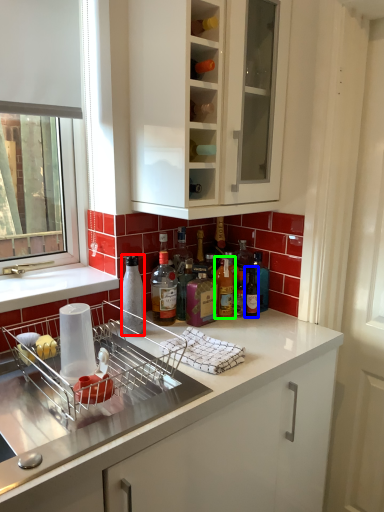
Question: Which object is positioned farthest from bottle (highlighted by a red box)? Select from bottle (highlighted by a blue box) and bottle (highlighted by a green box).

Choices:
 (A) bottle
 (B) bottle

Answer: (A)